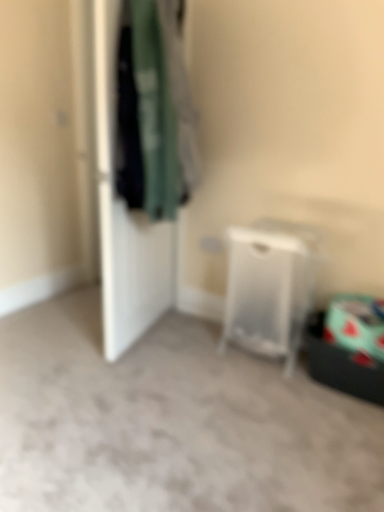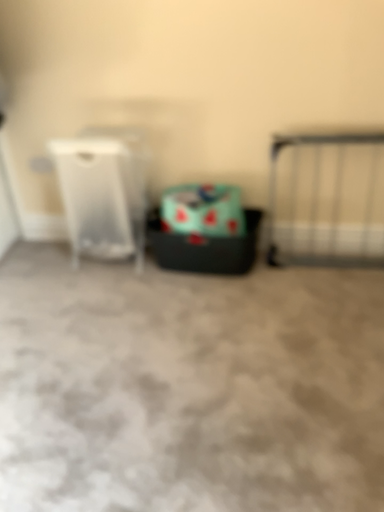
Question: How did the camera likely rotate when shooting the video?

Choices:
 (A) rotated downward
 (B) rotated upward

Answer: (A)